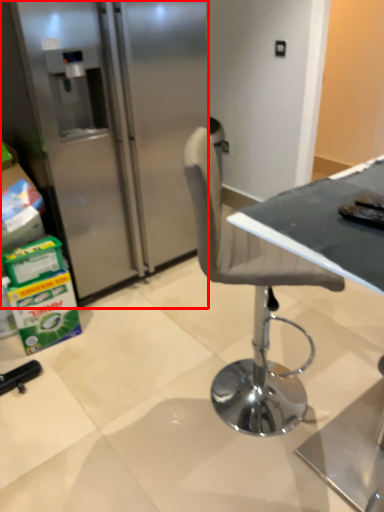
Question: From the image's perspective, what is the correct spatial positioning of refrigerator (annotated by the red box) in reference to table?

Choices:
 (A) below
 (B) above

Answer: (B)